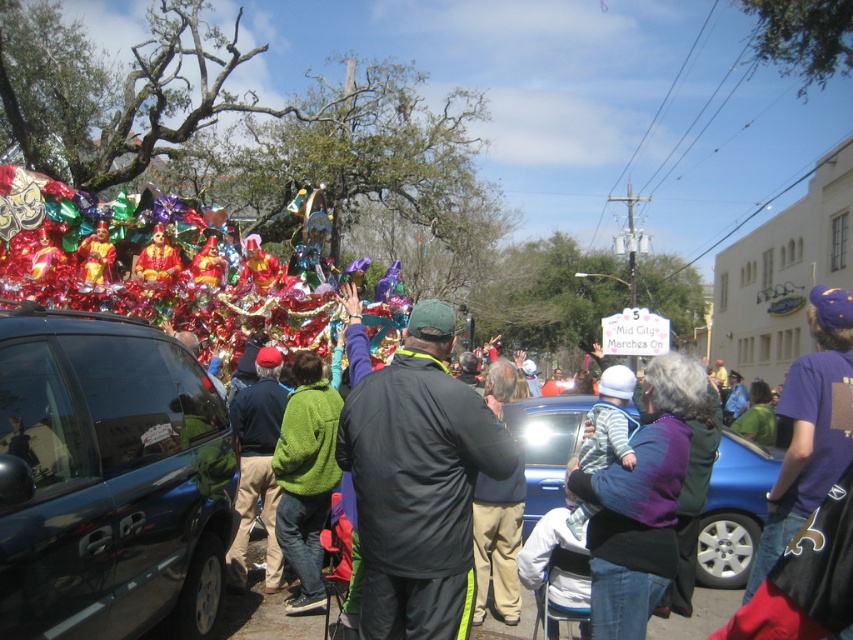
You are a photographer trying to capture the crowd at the parade. You notice the black fabric jacket at center and the purple cotton shirt at right. Which clothing item should you focus on if you want to photograph the narrower one?

The black fabric jacket at center is narrower than the purple cotton shirt at right, so you should focus on the black fabric jacket at center.

You are a photographer at the parade and want to capture both the glossy dark blue van at left and the blue metallic car at center in a single shot. Based on their positions, which vehicle should you position closer to the left side of your camera frame?

You should position the glossy dark blue van at left closer to the left side of your camera frame since it is located to the left of the blue metallic car at center in the scene.